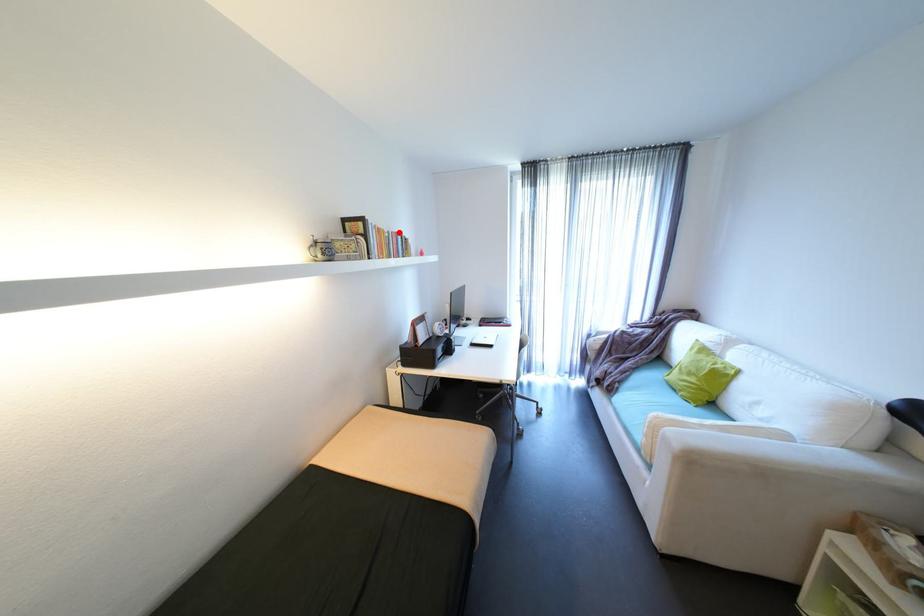
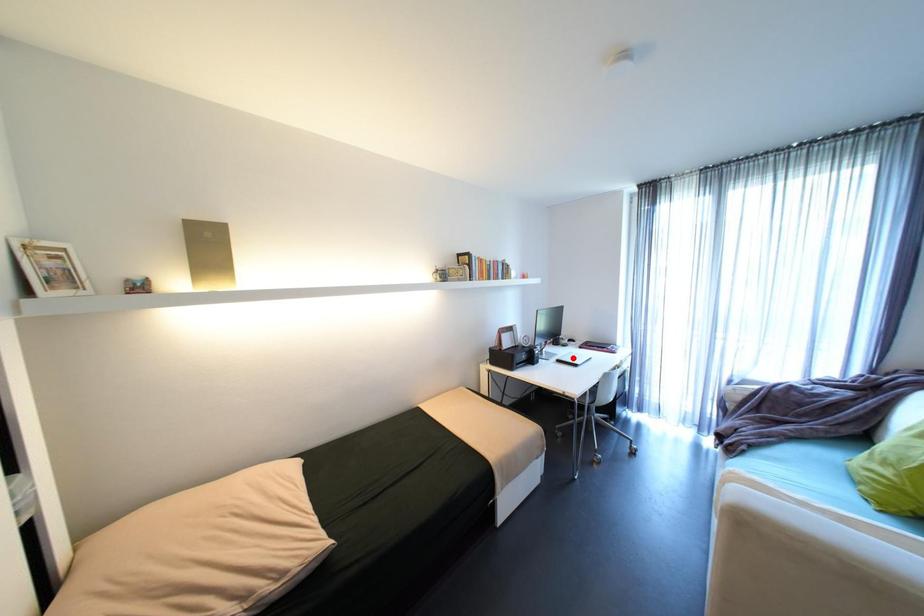
I am providing you with two images of the same scene from different viewpoints. A red point is marked on the first image and another point is marked on the second image. Is the red point in image1 aligned with the point shown in image2?

No